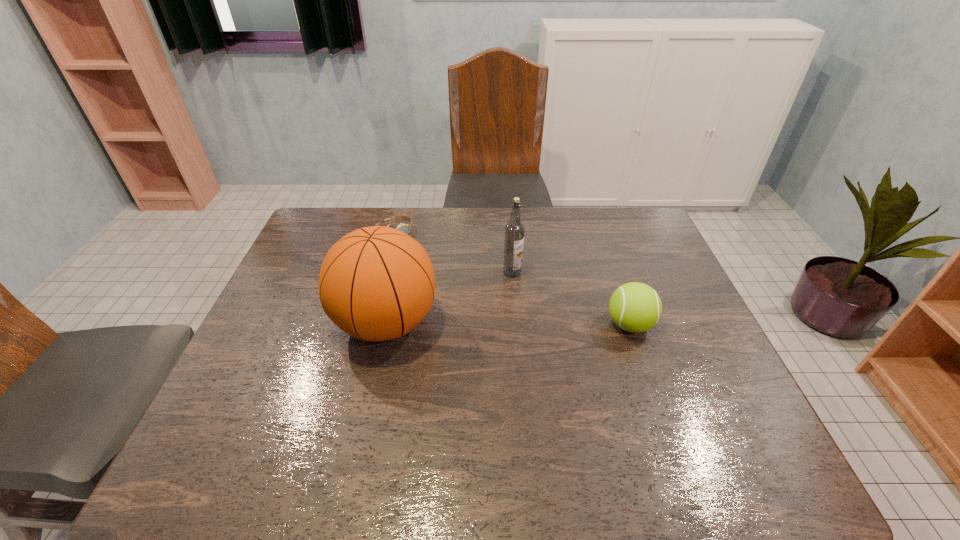
Locate an element on the screen. The width and height of the screenshot is (960, 540). free spot located 0.140m on the face of the watch is located at coordinates (427, 262).

Locate an element on the screen. The height and width of the screenshot is (540, 960). free location located on the face of the watch is located at coordinates (463, 294).

Find the location of a particular element. Image resolution: width=960 pixels, height=540 pixels. blank space located on the label of the second object from right to left is located at coordinates (549, 365).

Locate an element on the screen. The width and height of the screenshot is (960, 540). vacant space located 0.270m on the label of the second object from right to left is located at coordinates (542, 349).

Identify the location of vacant area situated on the label of the second object from right to left. This screenshot has height=540, width=960. click(x=527, y=309).

Where is `object that is positioned at the far edge`? This screenshot has height=540, width=960. object that is positioned at the far edge is located at coordinates (406, 228).

Locate an element on the screen. This screenshot has height=540, width=960. object situated at the right edge is located at coordinates (635, 307).

In the image, there is a desktop. What are the coordinates of `vacant space at the far edge` in the screenshot? It's located at (591, 220).

In the image, there is a desktop. Identify the location of vacant region at the near edge. coord(621,411).

In the image, there is a desktop. At what (x,y) coordinates should I click in order to perform the action: click on free region at the left edge. Please return your answer as a coordinate pair (x, y). Looking at the image, I should click on (306, 339).